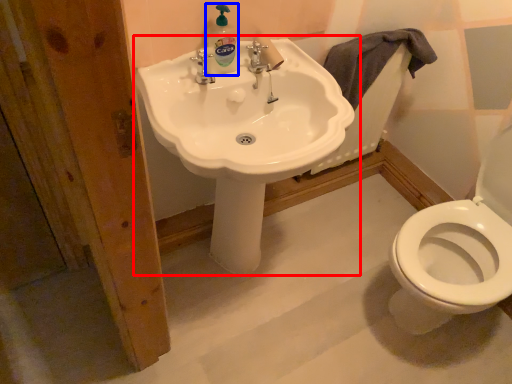
Question: Among these objects, which one is farthest to the camera, sink (highlighted by a red box) or cleaning product (highlighted by a blue box)?

Choices:
 (A) sink
 (B) cleaning product

Answer: (B)